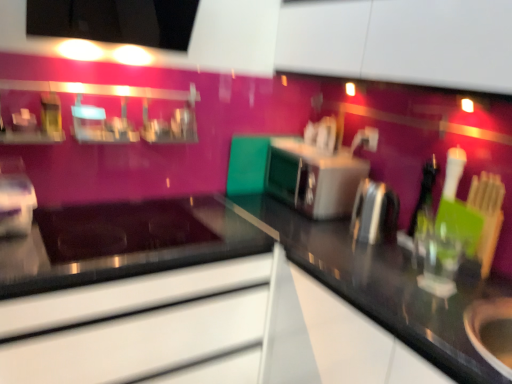
The width and height of the screenshot is (512, 384). What do you see at coordinates (15, 198) in the screenshot?
I see `plastic container at lower left, which is the second appliance from front to back` at bounding box center [15, 198].

Find the location of a particular element. metallic silver oven at center is located at coordinates (313, 178).

The height and width of the screenshot is (384, 512). What do you see at coordinates (250, 254) in the screenshot?
I see `black glossy countertop at center` at bounding box center [250, 254].

Describe the element at coordinates (490, 331) in the screenshot. I see `metallic silver kettle at right, the first appliance from the front` at that location.

At what (x,y) coordinates should I click in order to perform the action: click on satin silver toaster at center, the 2th appliance viewed from the right. Please return your answer as a coordinate pair (x, y). This screenshot has height=384, width=512. Looking at the image, I should click on (375, 213).

Identify the location of plastic container at lower left, positioned as the 3th appliance in right-to-left order. click(x=15, y=198).

How much distance is there between satin silver toaster at center, positioned as the 3th appliance in front-to-back order, and metallic silver oven at center?

satin silver toaster at center, positioned as the 3th appliance in front-to-back order, and metallic silver oven at center are 27.29 centimeters apart from each other.

Between point (365, 235) and point (301, 155), which one is positioned in front?

Point (365, 235)

Considering the relative sizes of satin silver toaster at center, acting as the second appliance starting from the left, and metallic silver oven at center in the image provided, is satin silver toaster at center, acting as the second appliance starting from the left, wider than metallic silver oven at center?

In fact, satin silver toaster at center, acting as the second appliance starting from the left, might be narrower than metallic silver oven at center.

The height and width of the screenshot is (384, 512). In order to click on appliance that is the 1st one when counting rightward from the metallic silver oven at center in this screenshot , I will do `click(375, 213)`.

Looking at this image, from a real-world perspective, is plastic container at lower left, positioned as the 3th appliance in right-to-left order, positioned above or below satin silver toaster at center, the 2th appliance viewed from the right?

In terms of real-world spatial position, plastic container at lower left, positioned as the 3th appliance in right-to-left order, is below satin silver toaster at center, the 2th appliance viewed from the right.

Is plastic container at lower left, the 2th appliance positioned from the back, surrounding satin silver toaster at center, positioned as the 3th appliance in front-to-back order?

No, satin silver toaster at center, positioned as the 3th appliance in front-to-back order, is not inside plastic container at lower left, the 2th appliance positioned from the back.

Between plastic container at lower left, the first appliance from the left, and satin silver toaster at center, acting as the second appliance starting from the left, which one has smaller size?

Smaller between the two is satin silver toaster at center, acting as the second appliance starting from the left.

Between plastic container at lower left, which is the second appliance from front to back, and satin silver toaster at center, acting as the second appliance starting from the left, which one appears on the right side from the viewer's perspective?

satin silver toaster at center, acting as the second appliance starting from the left.

Considering the relative sizes of metallic silver oven at center and plastic container at lower left, which is the second appliance from front to back, in the image provided, is metallic silver oven at center bigger than plastic container at lower left, which is the second appliance from front to back,?

Yes, metallic silver oven at center is bigger than plastic container at lower left, which is the second appliance from front to back.

From the image's perspective, which is above, metallic silver oven at center or plastic container at lower left, which is the second appliance from front to back?

metallic silver oven at center is shown above in the image.

How far apart are metallic silver oven at center and plastic container at lower left, the 2th appliance positioned from the back?

metallic silver oven at center is 3.87 feet away from plastic container at lower left, the 2th appliance positioned from the back.

Is the surface of metallic silver oven at center in direct contact with plastic container at lower left, the first appliance from the left?

No, metallic silver oven at center is not next to plastic container at lower left, the first appliance from the left.

Would you say plastic container at lower left, positioned as the 3th appliance in right-to-left order, is inside or outside black glossy countertop at center?

plastic container at lower left, positioned as the 3th appliance in right-to-left order, exists outside the volume of black glossy countertop at center.

Which object is wider, plastic container at lower left, the first appliance from the left, or black glossy countertop at center?

black glossy countertop at center is wider.

Which of these two, plastic container at lower left, positioned as the 3th appliance in right-to-left order, or black glossy countertop at center, is smaller?

Smaller between the two is plastic container at lower left, positioned as the 3th appliance in right-to-left order.

I want to click on countertop located on the left of metallic silver oven at center, so click(250, 254).

Considering the sizes of objects metallic silver oven at center and black glossy countertop at center in the image provided, who is smaller, metallic silver oven at center or black glossy countertop at center?

metallic silver oven at center is smaller.

From the image's perspective, which is below, metallic silver oven at center or black glossy countertop at center?

black glossy countertop at center.

Considering the relative positions of satin silver toaster at center, acting as the first appliance starting from the back, and plastic container at lower left, the 2th appliance positioned from the back, in the image provided, is satin silver toaster at center, acting as the first appliance starting from the back, to the left of plastic container at lower left, the 2th appliance positioned from the back, from the viewer's perspective?

No.

Which is behind, point (373, 200) or point (4, 221)?

The point (373, 200) is more distant.

Is satin silver toaster at center, acting as the second appliance starting from the left, in front of or behind plastic container at lower left, which is the second appliance from front to back, in the image?

Clearly, satin silver toaster at center, acting as the second appliance starting from the left, is behind plastic container at lower left, which is the second appliance from front to back.

Is metallic silver kettle at right, positioned as the third appliance in back-to-front order, looking in the opposite direction of black glossy countertop at center?

Yes, metallic silver kettle at right, positioned as the third appliance in back-to-front order,'s orientation is away from black glossy countertop at center.

Locate an element on the screen. The image size is (512, 384). countertop that appears below the metallic silver kettle at right, the first appliance positioned from the right (from the image's perspective) is located at coordinates (250, 254).

From their relative heights in the image, would you say metallic silver kettle at right, which is the third appliance in left-to-right order, is taller or shorter than black glossy countertop at center?

metallic silver kettle at right, which is the third appliance in left-to-right order, is shorter than black glossy countertop at center.

From a real-world perspective, is metallic silver kettle at right, positioned as the third appliance in back-to-front order, physically located above or below black glossy countertop at center?

In terms of real-world spatial position, metallic silver kettle at right, positioned as the third appliance in back-to-front order, is above black glossy countertop at center.

Which appliance is the 1st one when counting from the right side of the metallic silver oven at center? Please provide its 2D coordinates.

[(375, 213)]

The width and height of the screenshot is (512, 384). I want to click on appliance above the satin silver toaster at center, positioned as the 3th appliance in front-to-back order (from the image's perspective), so click(x=15, y=198).

From the image, which object appears to be nearer to satin silver toaster at center, acting as the first appliance starting from the back, metallic silver kettle at right, the first appliance from the front, or metallic silver oven at center?

metallic silver oven at center.

Based on their spatial positions, is satin silver toaster at center, acting as the second appliance starting from the left, or metallic silver oven at center closer to metallic silver kettle at right, positioned as the third appliance in back-to-front order?

satin silver toaster at center, acting as the second appliance starting from the left, is positioned closer to the anchor metallic silver kettle at right, positioned as the third appliance in back-to-front order.

Which object lies further to the anchor point satin silver toaster at center, acting as the first appliance starting from the back, plastic container at lower left, the first appliance from the left, or metallic silver oven at center?

plastic container at lower left, the first appliance from the left, is positioned further to the anchor satin silver toaster at center, acting as the first appliance starting from the back.

When comparing their distances from plastic container at lower left, the 2th appliance positioned from the back, does black glossy countertop at center or satin silver toaster at center, acting as the second appliance starting from the left, seem closer?

Among the two, black glossy countertop at center is located nearer to plastic container at lower left, the 2th appliance positioned from the back.

Estimate the real-world distances between objects in this image. Which object is further from black glossy countertop at center, plastic container at lower left, the 2th appliance positioned from the back, or metallic silver kettle at right, which is the third appliance in left-to-right order?

plastic container at lower left, the 2th appliance positioned from the back.

Considering their positions, is black glossy countertop at center positioned closer to metallic silver oven at center than plastic container at lower left, the first appliance from the left?

black glossy countertop at center is closer to metallic silver oven at center.

Which object lies further to the anchor point plastic container at lower left, which is the second appliance from front to back, metallic silver oven at center or metallic silver kettle at right, the first appliance positioned from the right?

The object further to plastic container at lower left, which is the second appliance from front to back, is metallic silver kettle at right, the first appliance positioned from the right.

Estimate the real-world distances between objects in this image. Which object is closer to metallic silver oven at center, plastic container at lower left, the first appliance from the left, or metallic silver kettle at right, the first appliance from the front?

Among the two, metallic silver kettle at right, the first appliance from the front, is located nearer to metallic silver oven at center.

Image resolution: width=512 pixels, height=384 pixels. I want to click on oven between plastic container at lower left, positioned as the 3th appliance in right-to-left order, and satin silver toaster at center, acting as the first appliance starting from the back, in the horizontal direction, so click(x=313, y=178).

You are a GUI agent. You are given a task and a screenshot of the screen. Output one action in this format:
    pyautogui.click(x=<x>, y=<y>)
    Task: Click on the countertop between plastic container at lower left, which is the second appliance from front to back, and satin silver toaster at center, the 2th appliance viewed from the right, in the horizontal direction
    This screenshot has width=512, height=384.
    Given the screenshot: What is the action you would take?
    pyautogui.click(x=250, y=254)

Where is `appliance located between plastic container at lower left, which is the second appliance from front to back, and metallic silver kettle at right, the first appliance from the front, in the left-right direction`? This screenshot has width=512, height=384. appliance located between plastic container at lower left, which is the second appliance from front to back, and metallic silver kettle at right, the first appliance from the front, in the left-right direction is located at coordinates (375, 213).

I want to click on oven situated between plastic container at lower left, which is the second appliance from front to back, and metallic silver kettle at right, positioned as the third appliance in back-to-front order, from left to right, so click(x=313, y=178).